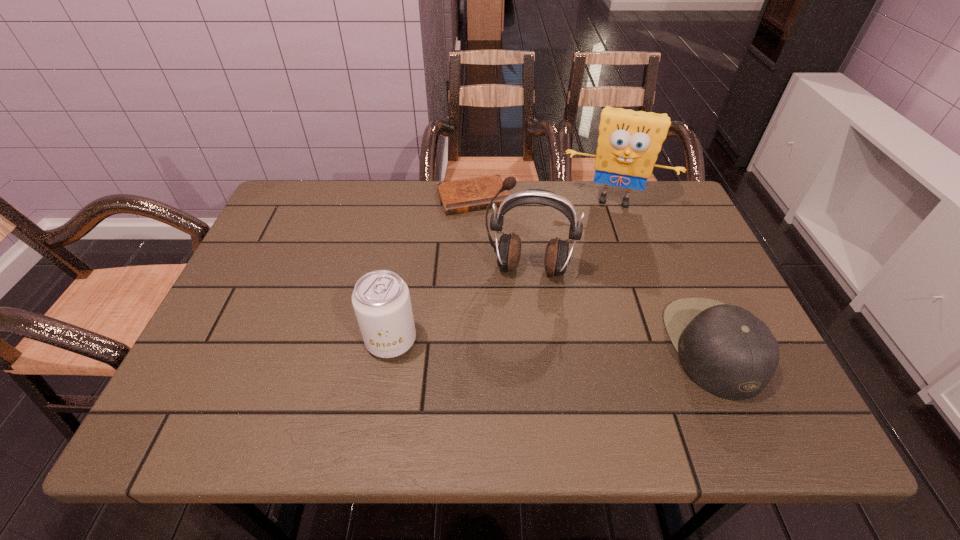
This screenshot has height=540, width=960. Identify the location of blank space located 0.180m on the ear pads of the third nearest object. (515, 346).

Locate an element on the screen. free space located on the ear pads of the third nearest object is located at coordinates (521, 305).

I want to click on vacant space situated on the ear pads of the third nearest object, so coord(511,374).

Where is `vacant space located 0.260m on the face of the sponge`? The width and height of the screenshot is (960, 540). vacant space located 0.260m on the face of the sponge is located at coordinates (590, 275).

Where is `free spot located on the face of the sponge`? The height and width of the screenshot is (540, 960). free spot located on the face of the sponge is located at coordinates (591, 270).

Locate an element on the screen. free spot located 0.290m on the face of the sponge is located at coordinates (589, 284).

Where is `diary that is positioned at the far edge`? This screenshot has width=960, height=540. diary that is positioned at the far edge is located at coordinates (465, 195).

Locate an element on the screen. sponge at the far edge is located at coordinates (629, 141).

The height and width of the screenshot is (540, 960). I want to click on soda can that is at the near edge, so click(381, 300).

Locate an element on the screen. The height and width of the screenshot is (540, 960). cap that is at the near edge is located at coordinates (726, 350).